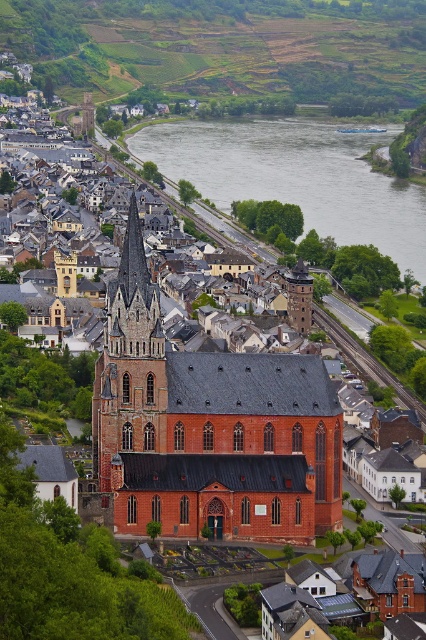
Question: Is gray/smooth water at center bigger than dark brown stone spire at upper left?

Choices:
 (A) no
 (B) yes

Answer: (B)

Question: Which point is farther to the camera?

Choices:
 (A) (134, 292)
 (B) (399, 204)

Answer: (B)

Question: Where is red brick church at center located in relation to dark brown stone spire at upper left in the image?

Choices:
 (A) left
 (B) right

Answer: (B)

Question: Estimate the real-world distances between objects in this image. Which object is farther from the dark brown stone spire at upper left?

Choices:
 (A) green grassy hillside at upper center
 (B) red brick church at center

Answer: (A)

Question: Is green grassy hillside at upper center further to the viewer compared to dark brown stone spire at upper left?

Choices:
 (A) yes
 (B) no

Answer: (A)

Question: Which object is the closest to the gray/smooth water at center?

Choices:
 (A) red brick church at center
 (B) dark brown stone spire at upper left
 (C) green grassy hillside at upper center
 (D) brick steeple at center

Answer: (C)